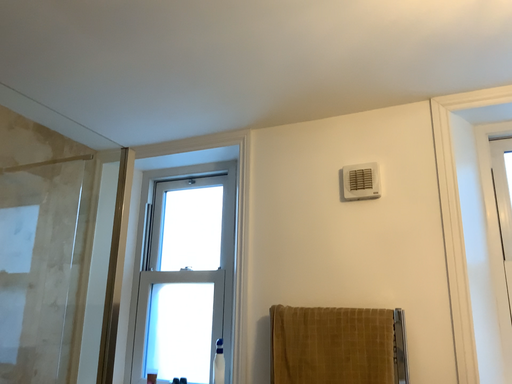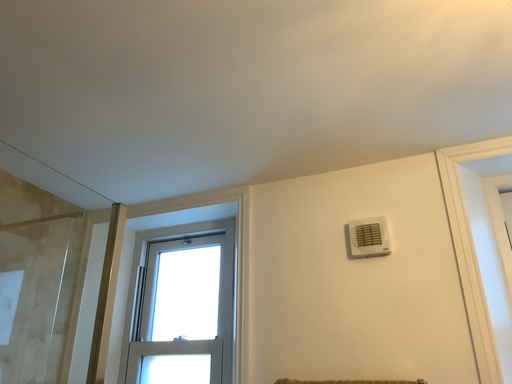
Question: Which way did the camera rotate in the video?

Choices:
 (A) rotated downward
 (B) rotated upward

Answer: (B)